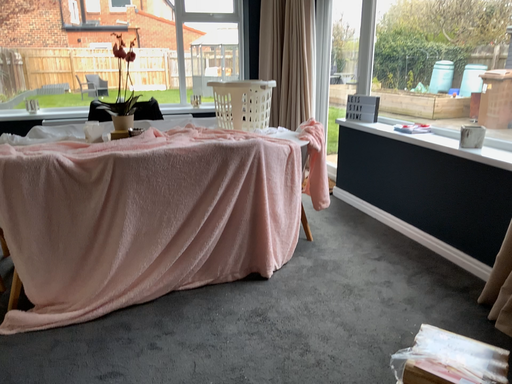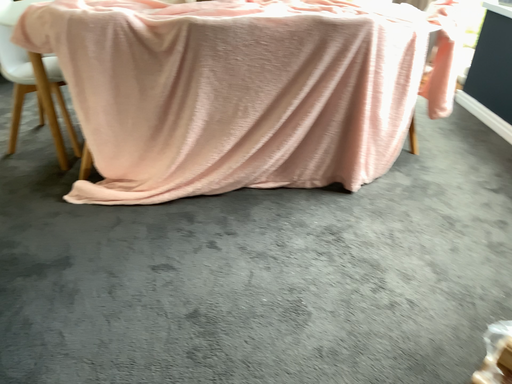
Question: How did the camera likely rotate when shooting the video?

Choices:
 (A) rotated left
 (B) rotated right

Answer: (A)